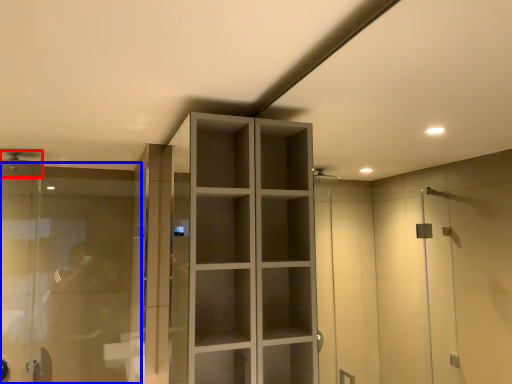
Question: Among these objects, which one is farthest to the camera, shower (highlighted by a red box) or glass door (highlighted by a blue box)?

Choices:
 (A) shower
 (B) glass door

Answer: (A)